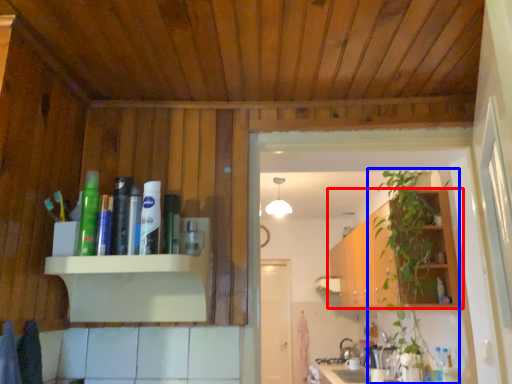
Question: Which object is closer to the camera taking this photo, cabinetry (highlighted by a red box) or houseplant (highlighted by a blue box)?

Choices:
 (A) cabinetry
 (B) houseplant

Answer: (B)